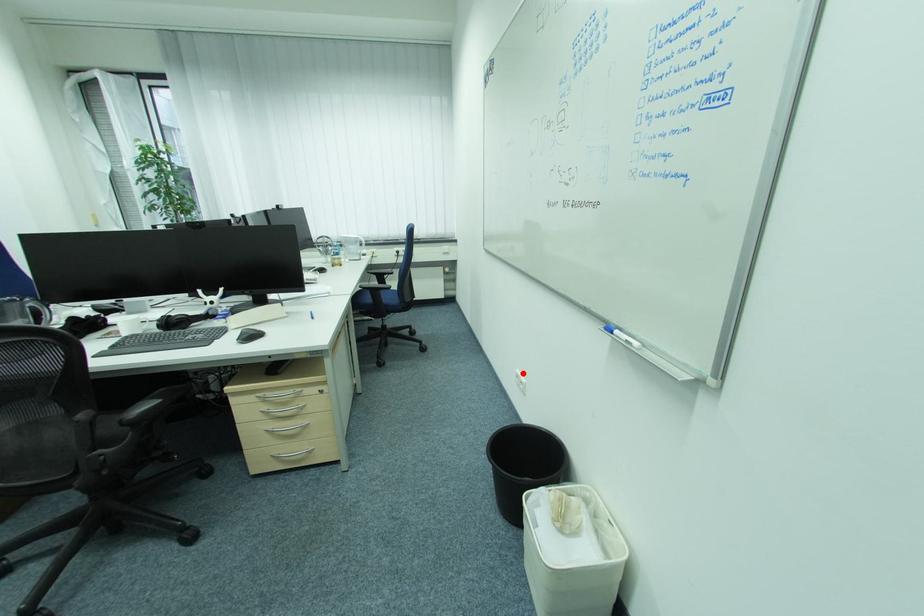
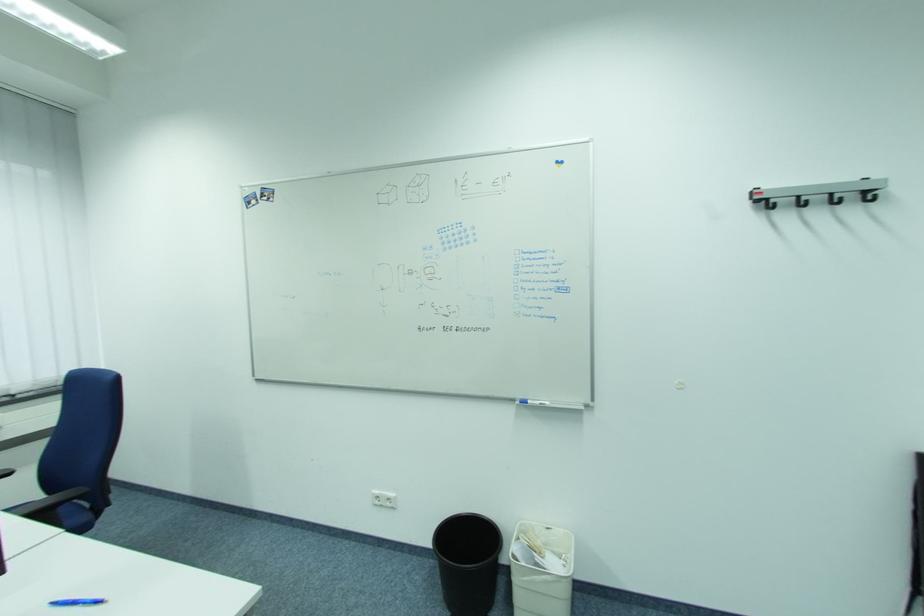
Locate, in the second image, the point that corresponds to the highlighted location in the first image.

(380, 496)